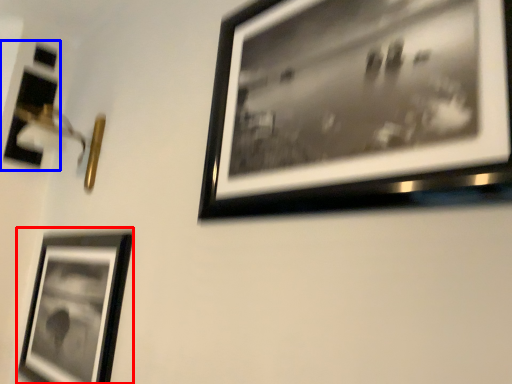
Question: Among these objects, which one is nearest to the camera, picture frame (highlighted by a red box) or picture frame (highlighted by a blue box)?

Choices:
 (A) picture frame
 (B) picture frame

Answer: (A)